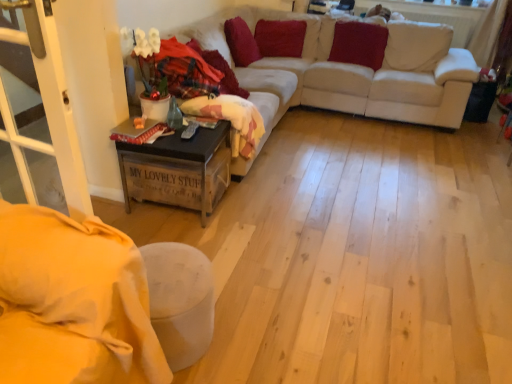
Question: Does wooden crate at lower left have a greater width compared to velvet red pillow at upper right, the 1th pillow positioned from the right?

Choices:
 (A) yes
 (B) no

Answer: (A)

Question: From a real-world perspective, is wooden crate at lower left on top of velvet red pillow at upper right, the 3th pillow in the left-to-right sequence?

Choices:
 (A) yes
 (B) no

Answer: (B)

Question: Does wooden crate at lower left lie behind velvet red pillow at upper right, the 3th pillow in the left-to-right sequence?

Choices:
 (A) no
 (B) yes

Answer: (A)

Question: Can you confirm if wooden crate at lower left is taller than velvet red pillow at upper right, the 3th pillow in the left-to-right sequence?

Choices:
 (A) no
 (B) yes

Answer: (B)

Question: From a real-world perspective, is wooden crate at lower left located beneath velvet red pillow at upper right, the 1th pillow positioned from the right?

Choices:
 (A) no
 (B) yes

Answer: (B)

Question: Do you think velvet red pillow at upper center, the 2th pillow positioned from the left, is within velvet red pillow at upper center, which is the 1th pillow in left-to-right order, or outside of it?

Choices:
 (A) inside
 (B) outside

Answer: (B)

Question: Is velvet red pillow at upper center, which ranks as the second pillow in right-to-left order, taller or shorter than velvet red pillow at upper center, which appears as the 3th pillow when viewed from the right?

Choices:
 (A) short
 (B) tall

Answer: (A)

Question: From the image's perspective, is velvet red pillow at upper center, the 2th pillow positioned from the left, located above or below velvet red pillow at upper center, which appears as the 3th pillow when viewed from the right?

Choices:
 (A) above
 (B) below

Answer: (A)

Question: Is point (256, 26) positioned closer to the camera than point (258, 52)?

Choices:
 (A) farther
 (B) closer

Answer: (A)

Question: Is velvet red pillow at upper center, which appears as the 3th pillow when viewed from the right, in front of or behind velvet red pillow at upper center, which ranks as the second pillow in right-to-left order, in the image?

Choices:
 (A) behind
 (B) front

Answer: (B)

Question: Considering the relative positions of velvet red pillow at upper center, which is the 1th pillow in left-to-right order, and velvet red pillow at upper center, which ranks as the second pillow in right-to-left order, in the image provided, is velvet red pillow at upper center, which is the 1th pillow in left-to-right order, to the left or to the right of velvet red pillow at upper center, which ranks as the second pillow in right-to-left order,?

Choices:
 (A) right
 (B) left

Answer: (B)

Question: Looking at the image, does velvet red pillow at upper center, which is the 1th pillow in left-to-right order, seem bigger or smaller compared to velvet red pillow at upper center, the 2th pillow positioned from the left?

Choices:
 (A) small
 (B) big

Answer: (A)

Question: From the image's perspective, is velvet red pillow at upper center, which is the 1th pillow in left-to-right order, positioned above or below velvet red pillow at upper center, the 2th pillow positioned from the left?

Choices:
 (A) above
 (B) below

Answer: (B)

Question: From a real-world perspective, is white plastic screen door at lower left positioned above or below velvet red pillow at upper center, which ranks as the second pillow in right-to-left order?

Choices:
 (A) above
 (B) below

Answer: (A)

Question: Considering the positions of point (89, 213) and point (268, 49), is point (89, 213) closer or farther from the camera than point (268, 49)?

Choices:
 (A) closer
 (B) farther

Answer: (A)